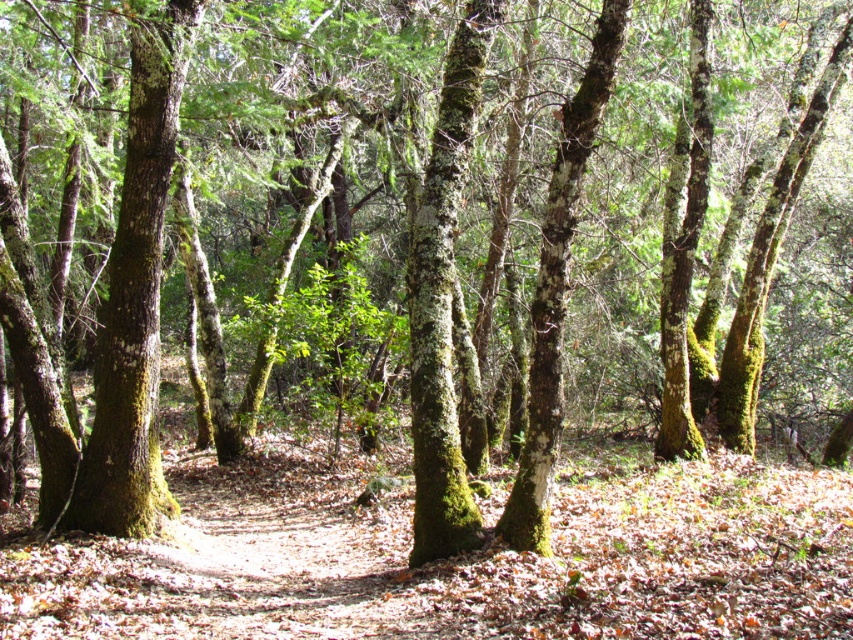
Find the location of a particular element. The image size is (853, 640). green mossy tree trunk at left is located at coordinates (135, 296).

At what (x,y) coordinates should I click in order to perform the action: click on green mossy tree trunk at left. Please return your answer as a coordinate pair (x, y). Looking at the image, I should click on (135, 296).